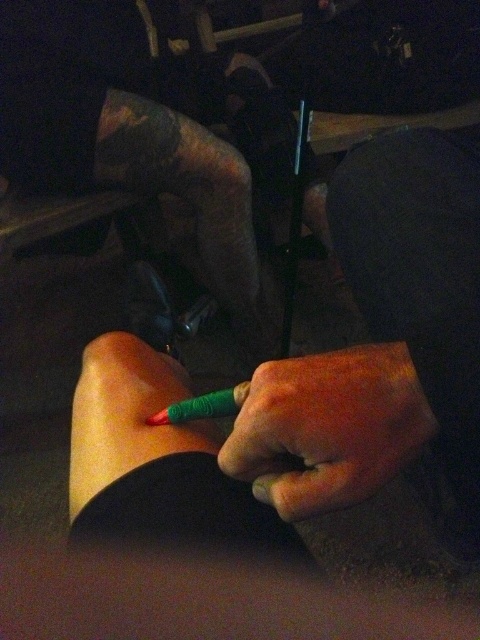
You are an artist trying to reach for your tools. You have a green matte pencil at lower left and a green matte pen at center. If your hand can only move 2 inches, can you reach the pen from the pencil without moving your hand?

The distance between the green matte pencil at lower left and the green matte pen at center is 2.11 inches. Since your hand can only move 2 inches, you cannot reach the pen from the pencil without moving your hand.